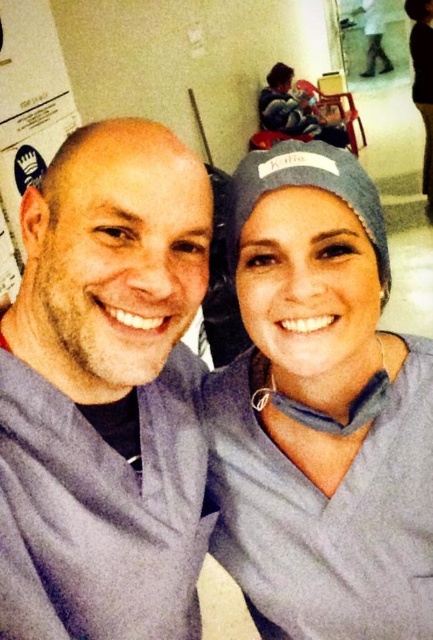
You are a healthcare worker in the hospital. You need to find the gray matte scrubs at left. Based on their 2D location at point 0.616, 0.245, which direction should you move relative to your current position at the center of the image to locate them?

The gray matte scrubs at left are located at 2D coordinates 0.616 on the x axis and 0.245 on the y axis. Since your current position is at the center of the image, you should move to the right along the x axis and slightly downward along the y axis to reach them.

You are a patient in a hospital and see the matte gray scrub at center and the gray fabric cap at upper center. Which one is shorter in height?

The matte gray scrub at center is shorter in height than the gray fabric cap at upper center because the description states it is not as tall as the cap.